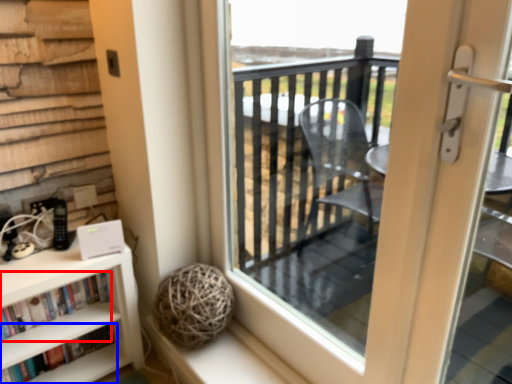
Question: Among these objects, which one is nearest to the camera, book (highlighted by a red box) or book (highlighted by a blue box)?

Choices:
 (A) book
 (B) book

Answer: (A)